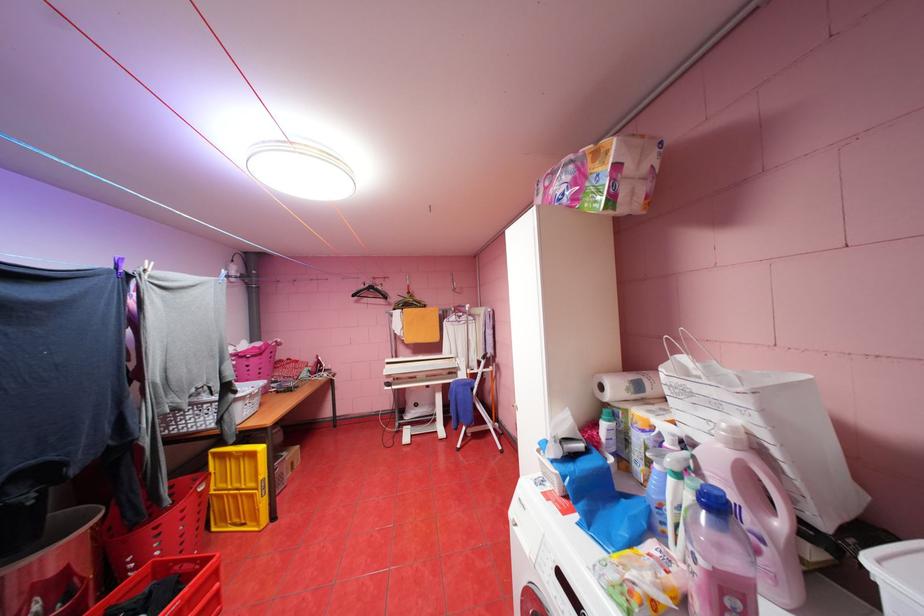
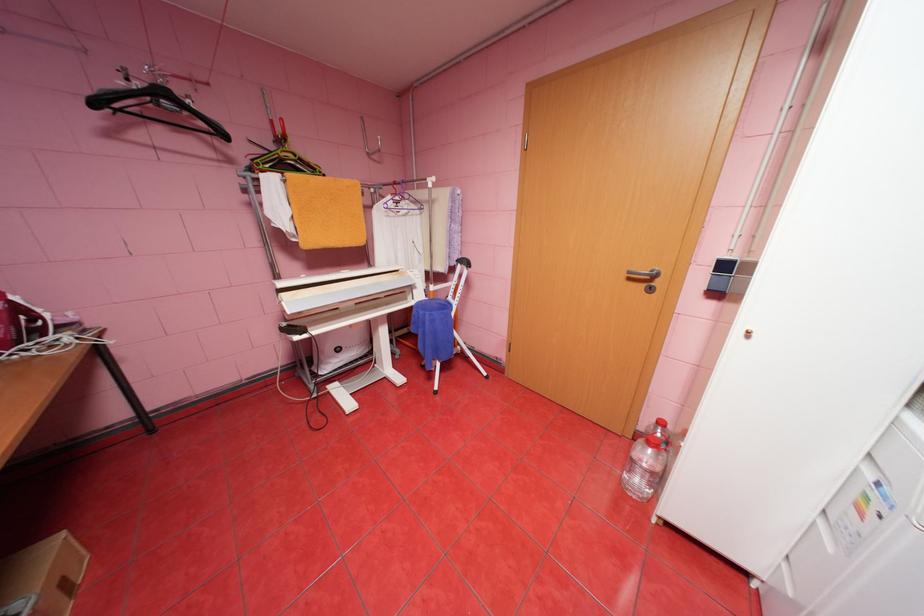
Locate, in the second image, the point that corresponds to (x=361, y=294) in the first image.

(103, 103)